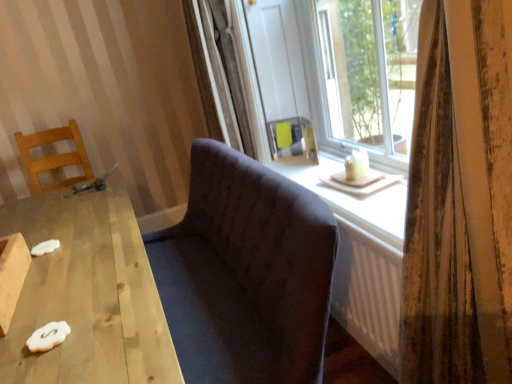
Question: Considering the positions of dark fabric couch at center and wooden table at lower left in the image, is dark fabric couch at center bigger or smaller than wooden table at lower left?

Choices:
 (A) small
 (B) big

Answer: (A)

Question: Considering the relative positions of dark fabric couch at center and wooden table at lower left in the image provided, is dark fabric couch at center to the left or to the right of wooden table at lower left?

Choices:
 (A) right
 (B) left

Answer: (A)

Question: Which of these objects is positioned farthest from the matte glass window at center?

Choices:
 (A) dark fabric couch at center
 (B) striped fabric curtain at right
 (C) wooden chair at left
 (D) wooden table at lower left

Answer: (C)

Question: Based on their relative distances, which object is nearer to the dark fabric couch at center?

Choices:
 (A) wooden chair at left
 (B) wooden table at lower left
 (C) matte glass window at center
 (D) striped fabric curtain at right

Answer: (B)